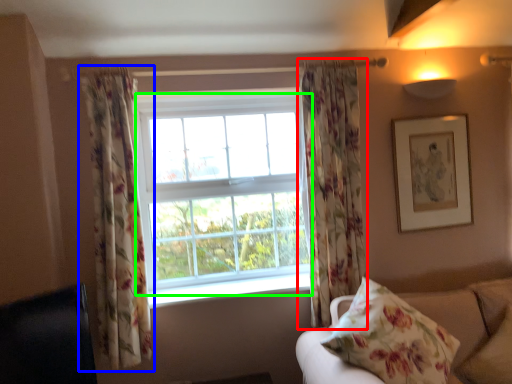
Question: Which is nearer to the curtain (highlighted by a red box)? curtain (highlighted by a blue box) or bay window (highlighted by a green box).

Choices:
 (A) curtain
 (B) bay window

Answer: (B)